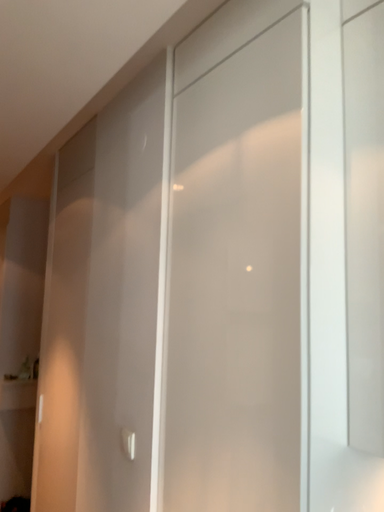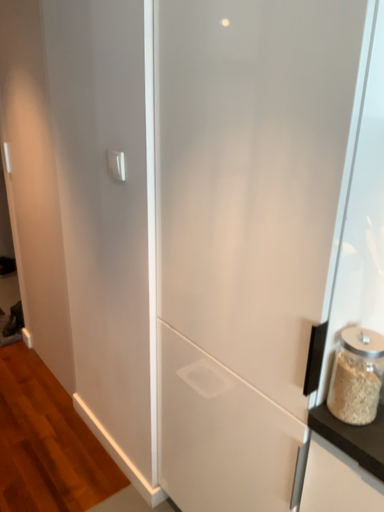
Question: Which way did the camera rotate in the video?

Choices:
 (A) rotated downward
 (B) rotated upward

Answer: (A)